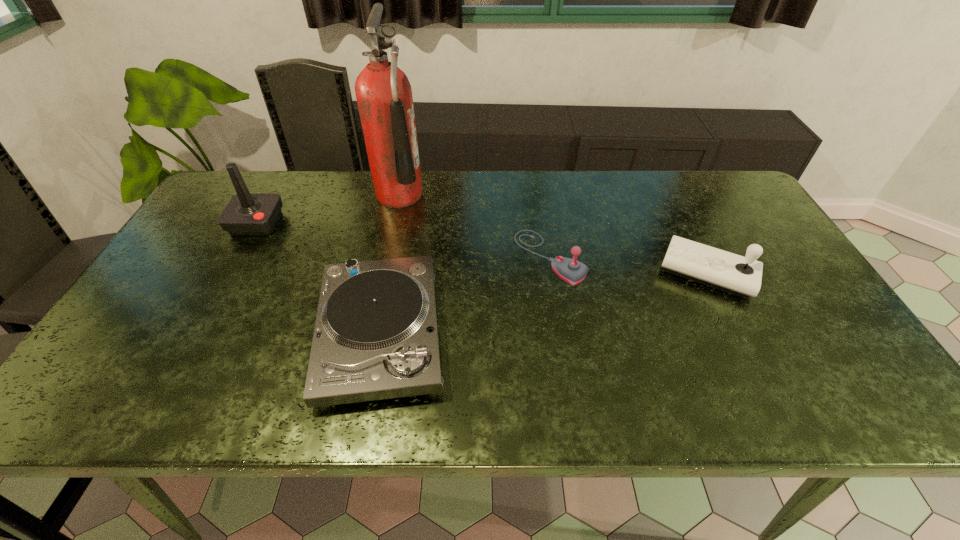
This screenshot has height=540, width=960. Identify the location of vacant space that satisfies the following two spatial constraints: 1. on the back side of the second object from right to left; 2. on the left side of the record player. (396, 257).

You are a GUI agent. You are given a task and a screenshot of the screen. Output one action in this format:
    pyautogui.click(x=<x>, y=<y>)
    Task: Click on the free spot that satisfies the following two spatial constraints: 1. on the front of the rightmost joystick near the operation label; 2. on the right side of the fire extinguisher
    
    Given the screenshot: What is the action you would take?
    pyautogui.click(x=382, y=272)